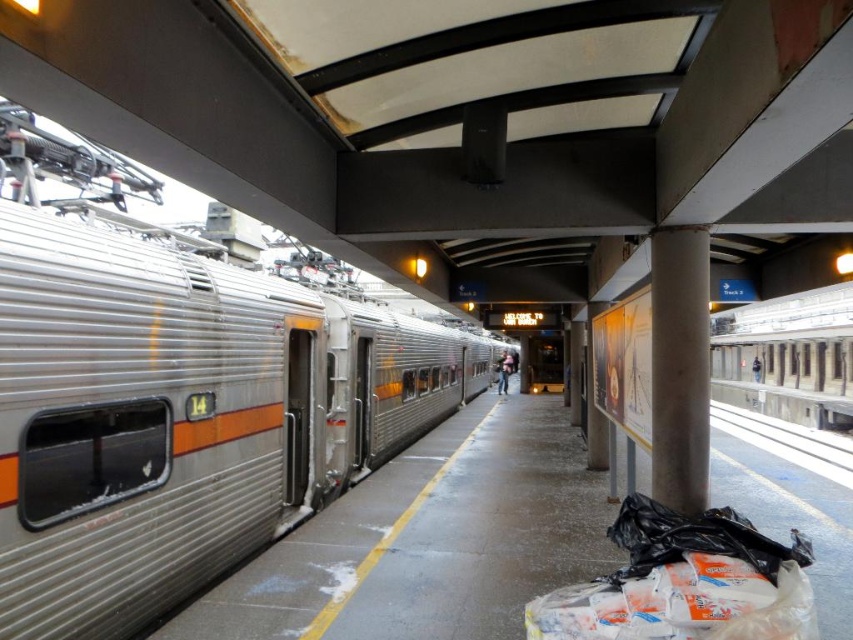
Question: Can you confirm if silver metallic train at left is positioned to the left of gray metallic train track at lower right?

Choices:
 (A) yes
 (B) no

Answer: (A)

Question: Which object is closer to the camera taking this photo?

Choices:
 (A) denim jacket at center
 (B) gray metallic train track at lower right

Answer: (B)

Question: Based on their relative distances, which object is nearer to the silver metallic train at left?

Choices:
 (A) gray metallic train track at lower right
 (B) denim jacket at center

Answer: (A)

Question: Does gray metallic train track at lower right appear on the right side of denim jacket at center?

Choices:
 (A) yes
 (B) no

Answer: (A)

Question: Where is gray metallic train track at lower right located in relation to denim jacket at center in the image?

Choices:
 (A) left
 (B) right

Answer: (B)

Question: Which point is farther to the camera?

Choices:
 (A) (206, 435)
 (B) (502, 372)

Answer: (B)